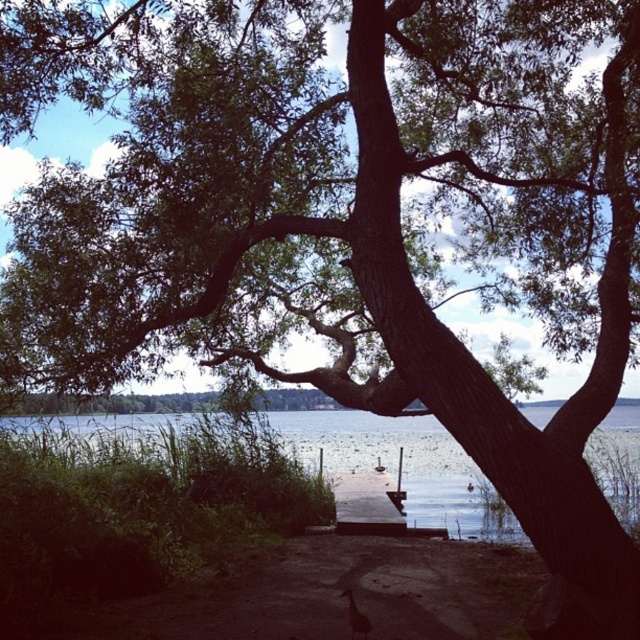
This screenshot has height=640, width=640. Describe the element at coordinates (404, 467) in the screenshot. I see `clear water at center` at that location.

Find the location of a particular element. clear water at center is located at coordinates (404, 467).